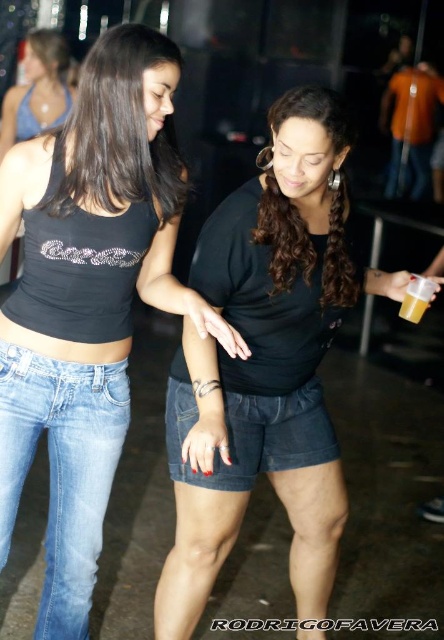
Question: Among these objects, which one is farthest from the camera?

Choices:
 (A) black matte tank top at upper left
 (B) matte blue tank top at upper left

Answer: (B)

Question: Does black matte shorts at center have a larger size compared to denim shorts at center?

Choices:
 (A) no
 (B) yes

Answer: (B)

Question: Does black matte shorts at center appear on the right side of light blue denim jeans at lower left?

Choices:
 (A) yes
 (B) no

Answer: (A)

Question: Which of the following is the farthest from the observer?

Choices:
 (A) matte blue tank top at upper left
 (B) denim shorts at center

Answer: (A)

Question: Is black matte tank top at upper left behind denim shorts at center?

Choices:
 (A) no
 (B) yes

Answer: (A)

Question: Estimate the real-world distances between objects in this image. Which object is farther from the denim shorts at center?

Choices:
 (A) light blue denim jeans at lower left
 (B) black matte tank top at upper left
 (C) matte blue tank top at upper left
 (D) black matte shorts at center

Answer: (C)